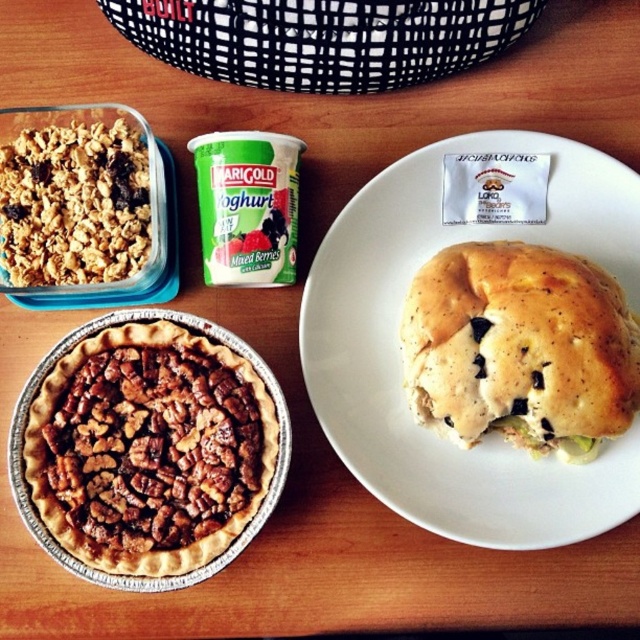
Question: Which of the following is the closest to the observer?

Choices:
 (A) (436, 531)
 (B) (154, 566)

Answer: (B)

Question: Does brown crumbly pie at lower left have a lesser width compared to crumbly brown granola at upper left?

Choices:
 (A) no
 (B) yes

Answer: (A)

Question: Among these points, which one is farthest from the camera?

Choices:
 (A) 524,385
 (B) 637,205
 (C) 93,177
 (D) 205,449

Answer: (C)

Question: Can you confirm if brown crumbly pie at lower left is positioned below golden bread roll at center-right?

Choices:
 (A) yes
 (B) no

Answer: (A)

Question: Does brown crumbly pie at lower left appear on the right side of golden bread roll at center-right?

Choices:
 (A) no
 (B) yes

Answer: (A)

Question: Which of the following is the closest to the observer?

Choices:
 (A) (96, 145)
 (B) (634, 358)
 (C) (122, 324)
 (D) (570, 144)

Answer: (B)